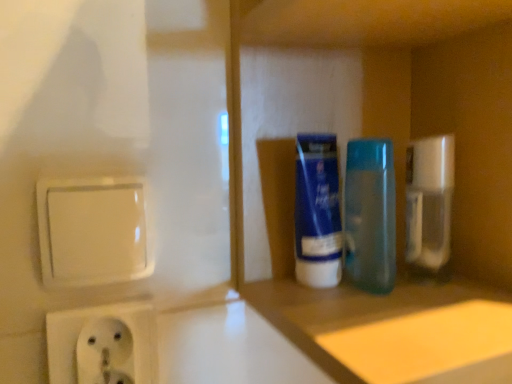
Question: Should I look upward or downward to see blue plastic bottles at center?

Choices:
 (A) down
 (B) up

Answer: (B)

Question: Does white plastic socket at lower left have a greater width compared to blue glossy tube at center, which appears as the 1th mouthwash when viewed from the left?

Choices:
 (A) yes
 (B) no

Answer: (B)

Question: Is white plastic socket at lower left at the left side of blue glossy tube at center, which is the 2th mouthwash in right-to-left order?

Choices:
 (A) no
 (B) yes

Answer: (B)

Question: Are white plastic socket at lower left and blue glossy tube at center, which is the 2th mouthwash in right-to-left order, making contact?

Choices:
 (A) no
 (B) yes

Answer: (A)

Question: Does white plastic socket at lower left have a greater height compared to blue glossy tube at center, which is the 2th mouthwash in right-to-left order?

Choices:
 (A) no
 (B) yes

Answer: (A)

Question: From a real-world perspective, does white plastic socket at lower left stand above blue glossy tube at center, which appears as the 1th mouthwash when viewed from the left?

Choices:
 (A) yes
 (B) no

Answer: (B)

Question: Is white plastic socket at lower left to the right of blue glossy tube at center, which is the 2th mouthwash in right-to-left order, from the viewer's perspective?

Choices:
 (A) yes
 (B) no

Answer: (B)

Question: From a real-world perspective, is blue plastic bottles at center over clear plastic spray bottle at right?

Choices:
 (A) no
 (B) yes

Answer: (B)

Question: Are blue plastic bottles at center and clear plastic spray bottle at right located far from each other?

Choices:
 (A) no
 (B) yes

Answer: (A)

Question: Can you confirm if blue plastic bottles at center is taller than clear plastic spray bottle at right?

Choices:
 (A) no
 (B) yes

Answer: (B)

Question: From a real-world perspective, is blue plastic bottles at center under clear plastic spray bottle at right?

Choices:
 (A) no
 (B) yes

Answer: (A)

Question: Is blue plastic bottles at center next to clear plastic spray bottle at right?

Choices:
 (A) yes
 (B) no

Answer: (A)

Question: From the image's perspective, would you say blue plastic bottles at center is positioned over clear plastic spray bottle at right?

Choices:
 (A) yes
 (B) no

Answer: (A)

Question: From a real-world perspective, is clear plastic spray bottle at right below blue translucent bottle at center, the 1th mouthwash positioned from the right?

Choices:
 (A) no
 (B) yes

Answer: (A)